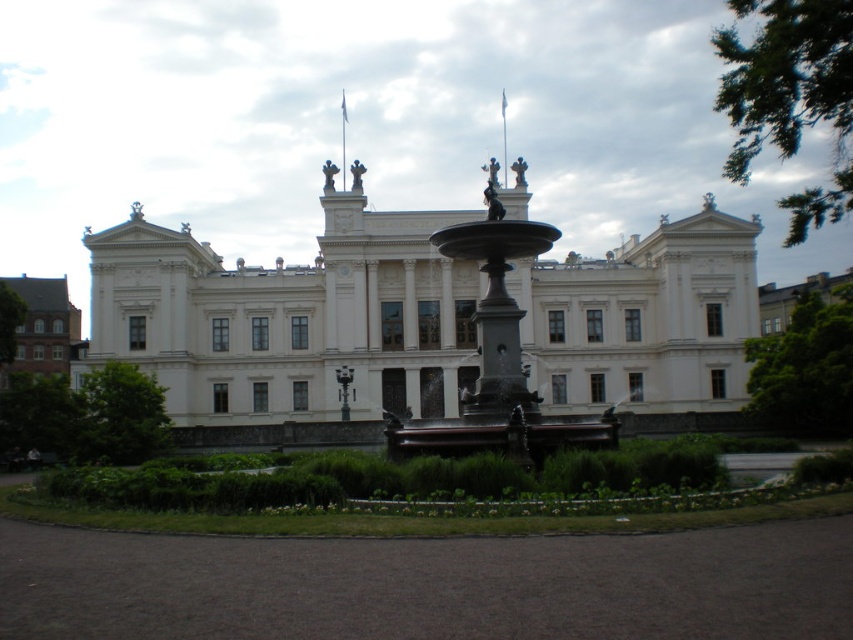
You are standing in front of a grand neoclassical building with a fountain nearby. You want to take a photo of the building while standing at point (566,321). Is this point far enough to capture the entire building in one shot?

The point (566,321) is 140.24 meters away from the viewer. Since the building is grand and neoclassical with a symmetrical facade, this distance should be sufficient to capture the entire building in one shot.

You are an architect visiting the site of the white stone building at center and the black polished stone fountain at center. You need to determine which structure is shorter. Based on the scene, which one is shorter?

The white stone building at center is not as tall as the black polished stone fountain at center, so the white stone building at center is shorter.

You are a visitor approaching the grand neoclassical building and the fountain in front of it. You want to take a photo that includes both the white stone building at center and the green leafy garden at center. Which object should you position closer to the left side of your camera frame?

You should position the green leafy garden at center closer to the left side of your camera frame because the white stone building at center is to the right of the green leafy garden at center.